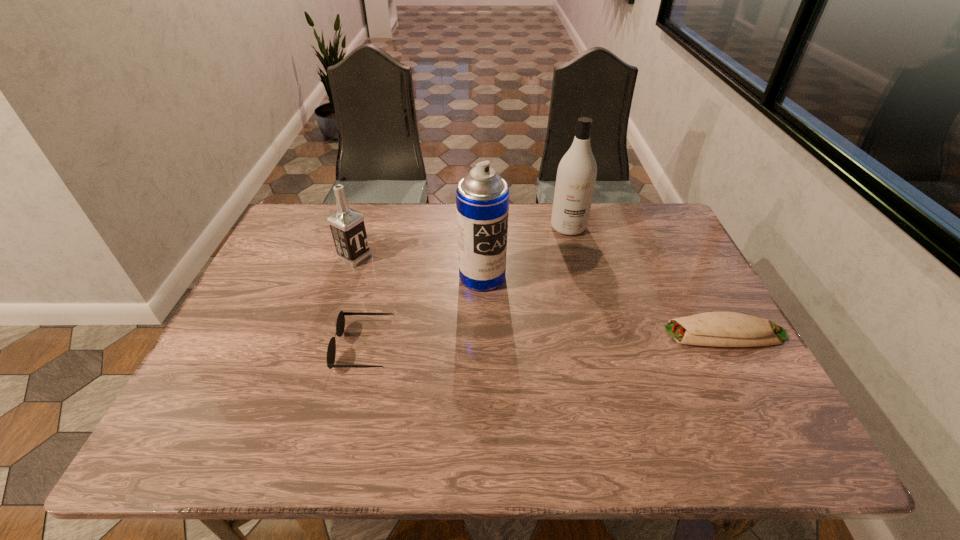
Find the location of a particular element. Image resolution: width=960 pixels, height=540 pixels. vacant space at the far right corner of the desktop is located at coordinates (626, 215).

The height and width of the screenshot is (540, 960). I want to click on empty space that is in between the third object from left to right and the farthest object, so 525,252.

At what (x,y) coordinates should I click in order to perform the action: click on vacant area between the fourth tallest object and the rightmost object. Please return your answer as a coordinate pair (x, y). Looking at the image, I should click on (544, 340).

Identify the location of free space between the third object from right to left and the vodka. Image resolution: width=960 pixels, height=540 pixels. (419, 267).

Image resolution: width=960 pixels, height=540 pixels. I want to click on vacant area that lies between the shampoo and the second shortest object, so click(467, 287).

The height and width of the screenshot is (540, 960). I want to click on vacant area that lies between the third object from left to right and the shampoo, so click(x=525, y=252).

Where is `vacant region between the burrito and the second object from right to left`? vacant region between the burrito and the second object from right to left is located at coordinates (646, 280).

This screenshot has width=960, height=540. In order to click on empty space that is in between the sunglasses and the vodka in this screenshot , I will do `click(360, 302)`.

You are a GUI agent. You are given a task and a screenshot of the screen. Output one action in this format:
    pyautogui.click(x=<x>, y=<y>)
    Task: Click on the unoccupied area between the third object from left to right and the second shortest object
    This screenshot has width=960, height=540.
    Given the screenshot: What is the action you would take?
    pyautogui.click(x=423, y=312)

This screenshot has height=540, width=960. Find the location of `unoccupied area between the shortest object and the sunglasses`. unoccupied area between the shortest object and the sunglasses is located at coordinates coord(544,340).